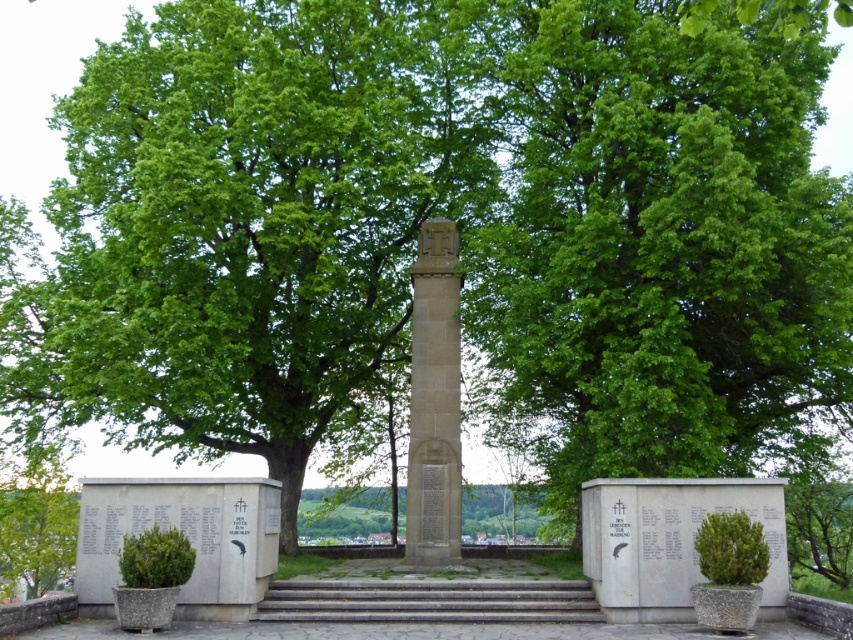
You are a photographer planning to capture the stone obelisk at center and the green leafy tree at lower left in the same frame. Based on their sizes, which object should you focus on to ensure both are clearly visible in the photo?

The stone obelisk at center is smaller than the green leafy tree at lower left. To ensure both are clearly visible in the photo, focus on the stone obelisk at center since it is smaller and requires more attention to detail.

You are standing at the base of the memorial structure and see the green leafy tree at center and the green leafy tree at lower left. Which tree is located to the right of the other?

The green leafy tree at center is positioned on the right side of green leafy tree at lower left.

You are standing at the base of the memorial steps. Looking up, you see two green leafy trees in the scene. Which tree, the green leafy tree at center or the green leafy tree at lower left, appears taller from your viewpoint?

The green leafy tree at center appears taller than the green leafy tree at lower left from your viewpoint.